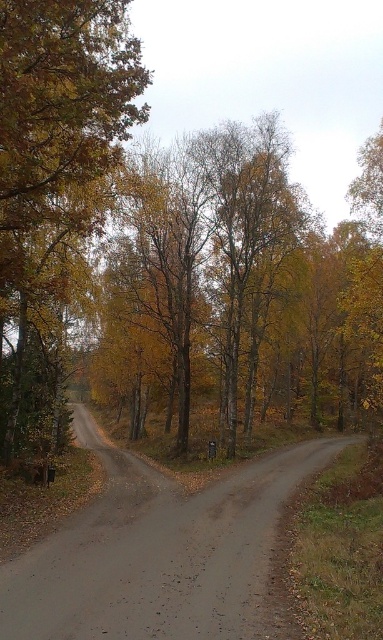
You are standing at the center of the dirt road fork and see the point marked at coordinates point (55,188). What color is the foliage located at that point?

The point (55,188) corresponds to yellow green foliage at left.